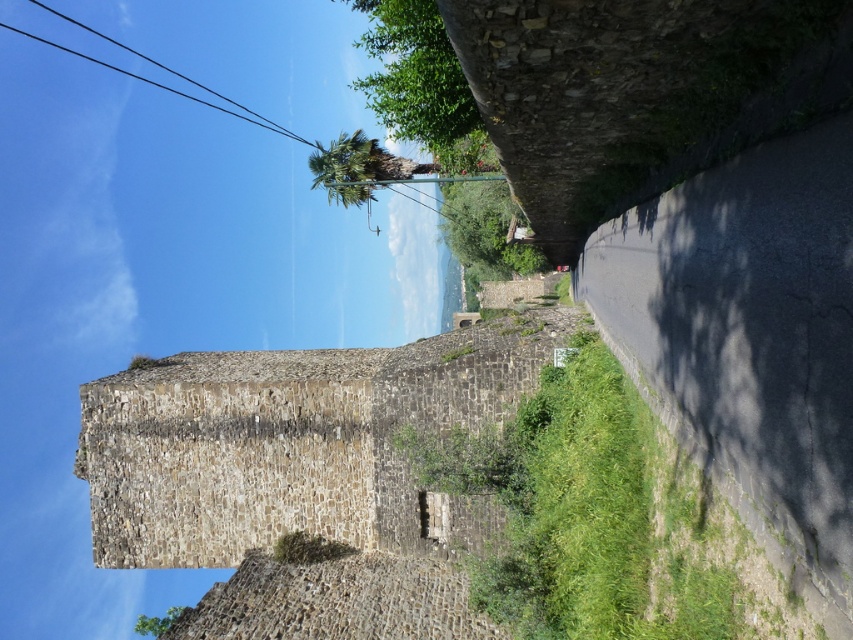
Does green leafy tree at center appear over green leafy palm at upper center?

Incorrect, green leafy tree at center is not positioned above green leafy palm at upper center.

Locate an element on the screen. This screenshot has height=640, width=853. green leafy tree at center is located at coordinates (486, 230).

Does green leafy tree at upper center have a lesser height compared to green leafy tree at center?

No.

What do you see at coordinates (416, 76) in the screenshot?
I see `green leafy tree at upper center` at bounding box center [416, 76].

You are a GUI agent. You are given a task and a screenshot of the screen. Output one action in this format:
    pyautogui.click(x=<x>, y=<y>)
    Task: Click on the green leafy tree at upper center
    The width and height of the screenshot is (853, 640).
    Given the screenshot: What is the action you would take?
    pyautogui.click(x=416, y=76)

Which is more to the left, black wire at upper left or green leafy tree at lower left?

Positioned to the left is black wire at upper left.

Does black wire at upper left have a smaller size compared to green leafy tree at lower left?

Yes, black wire at upper left is smaller than green leafy tree at lower left.

Between point (13, 29) and point (154, 630), which one is positioned in front?

Point (154, 630) is in front.

Locate an element on the screen. This screenshot has height=640, width=853. black wire at upper left is located at coordinates (160, 68).